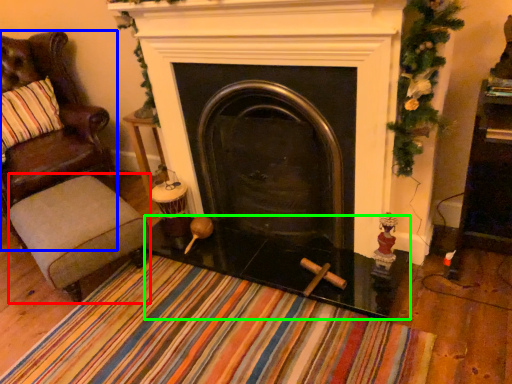
Question: Based on their relative distances, which object is farther from stool (highlighted by a red box)? Choose from chair (highlighted by a blue box) and glass table (highlighted by a green box).

Choices:
 (A) chair
 (B) glass table

Answer: (A)